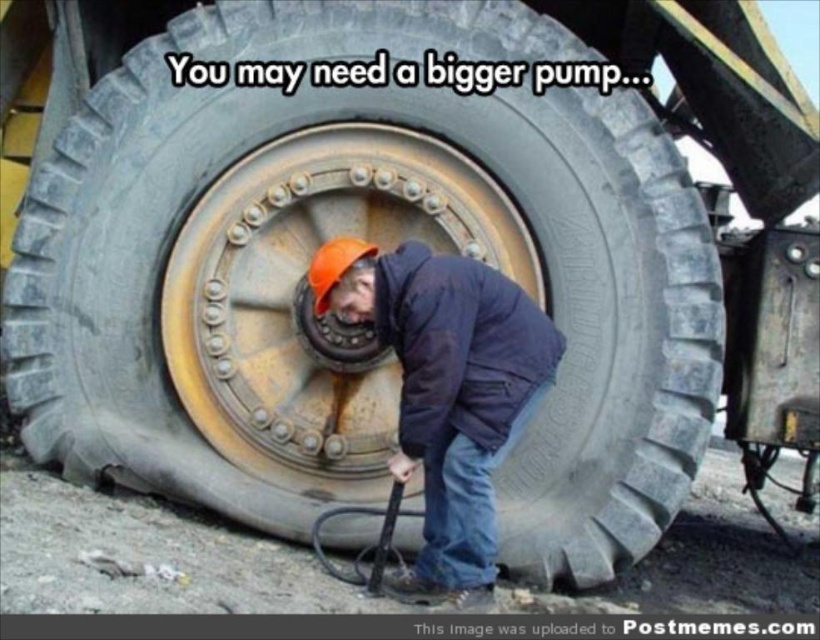
Between rusty metal rim at center and orange hard hat at center, which one appears on the right side from the viewer's perspective?

orange hard hat at center is more to the right.

Between point (292, 209) and point (475, 408), which one is positioned in front?

Point (475, 408) is in front.

The width and height of the screenshot is (820, 640). I want to click on rusty metal rim at center, so click(310, 294).